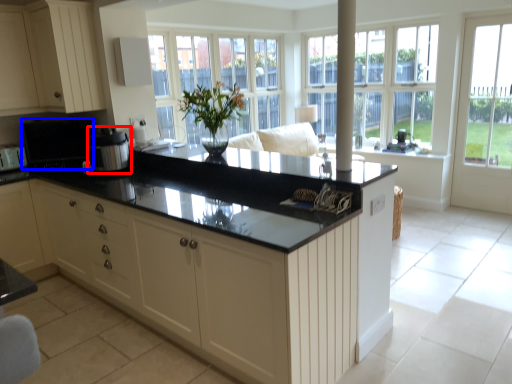
Question: Which of the following is the farthest to the observer, appliance (highlighted by a red box) or appliance (highlighted by a blue box)?

Choices:
 (A) appliance
 (B) appliance

Answer: (B)